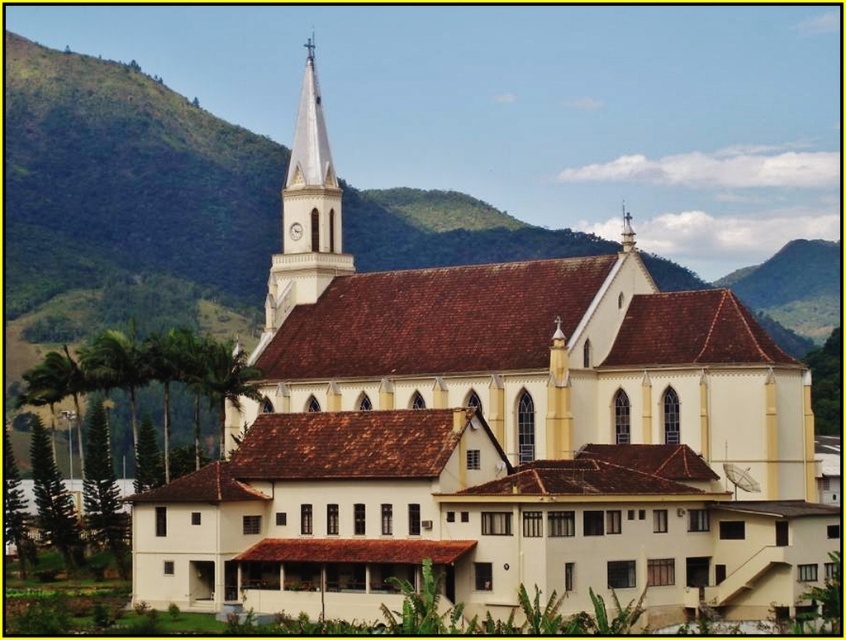
Is white glossy steeple at upper center shorter than smooth white spire at upper center?

No, white glossy steeple at upper center is not shorter than smooth white spire at upper center.

Is point (334, 237) in front of point (633, 248)?

No.

Where is `white glossy steeple at upper center`? The width and height of the screenshot is (846, 640). white glossy steeple at upper center is located at coordinates (306, 211).